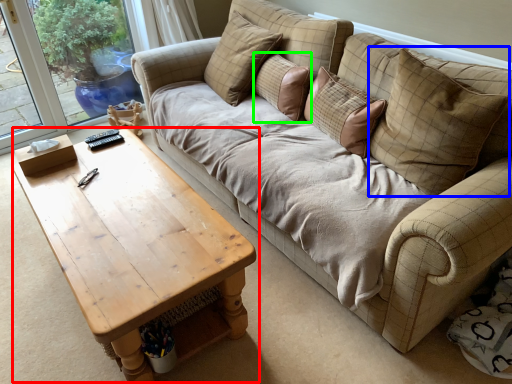
Question: Estimate the real-world distances between objects in this image. Which object is closer to coffee table (highlighted by a red box), pillow (highlighted by a blue box) or pillow (highlighted by a green box)?

Choices:
 (A) pillow
 (B) pillow

Answer: (A)